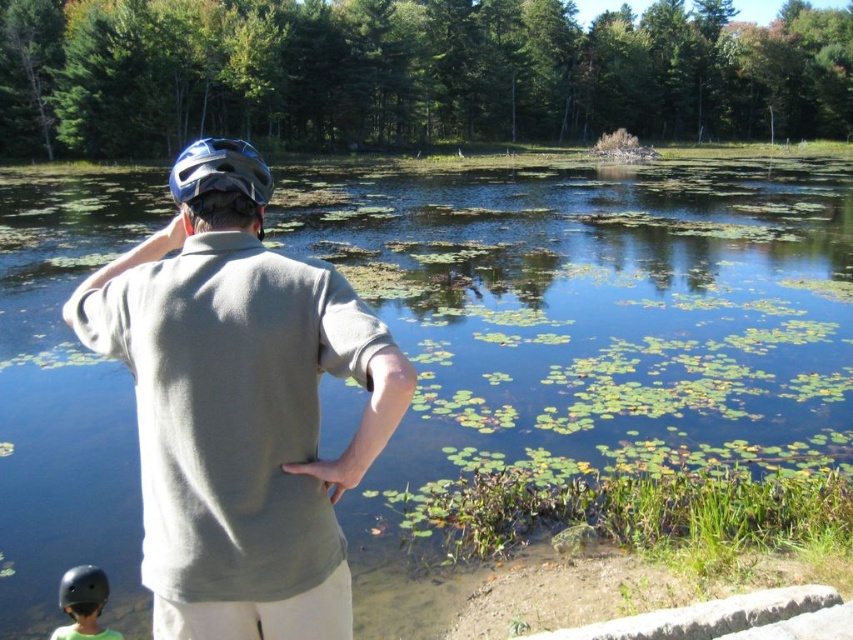
Is matte gray shirt at center wider than black matte helmet at lower left?

No.

Which is above, matte gray shirt at center or black matte helmet at lower left?

matte gray shirt at center

Is point (198, 140) more distant than point (102, 572)?

That is True.

This screenshot has height=640, width=853. Find the location of `matte gray shirt at center`. matte gray shirt at center is located at coordinates (239, 406).